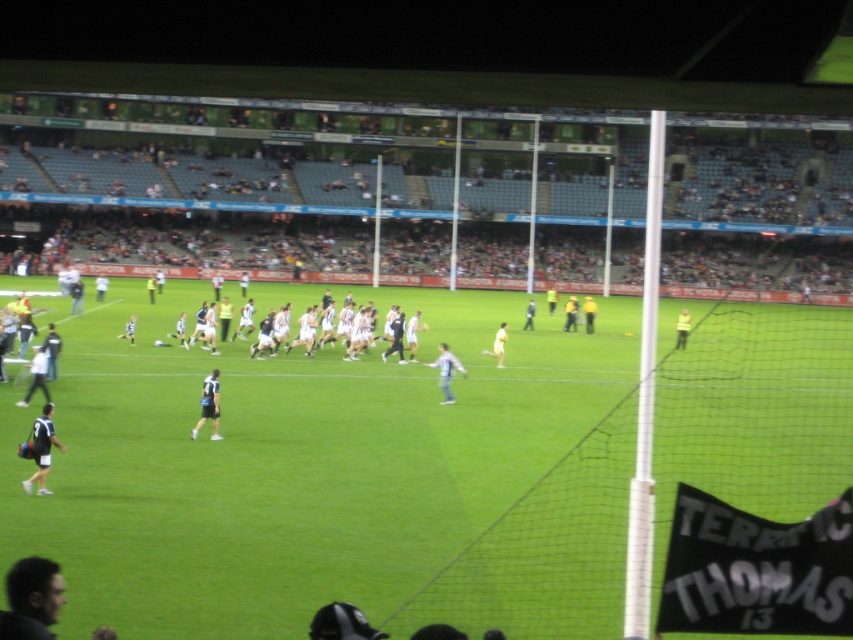
Does green grass field at center have a lesser width compared to yellow reflective vest at center?

Incorrect, green grass field at center's width is not less than yellow reflective vest at center's.

The image size is (853, 640). Find the location of `green grass field at center`. green grass field at center is located at coordinates (335, 477).

Identify the location of green grass field at center. The image size is (853, 640). (335, 477).

Between point (166, 625) and point (505, 330), which one is positioned in front?

Point (166, 625) is in front.

Does green grass field at center appear on the left side of white matte jersey at center?

Indeed, green grass field at center is positioned on the left side of white matte jersey at center.

Image resolution: width=853 pixels, height=640 pixels. Find the location of `green grass field at center`. green grass field at center is located at coordinates (335, 477).

Who is positioned more to the left, green grass field at center or dark brown hair at lower left?

Positioned to the left is dark brown hair at lower left.

Can you confirm if green grass field at center is wider than dark brown hair at lower left?

Yes, green grass field at center is wider than dark brown hair at lower left.

Is point (517, 547) behind point (10, 609)?

Yes, point (517, 547) is behind point (10, 609).

You are a GUI agent. You are given a task and a screenshot of the screen. Output one action in this format:
    pyautogui.click(x=<x>, y=<y>)
    Task: Click on the green grass field at center
    Image resolution: width=853 pixels, height=640 pixels.
    Given the screenshot: What is the action you would take?
    pyautogui.click(x=335, y=477)